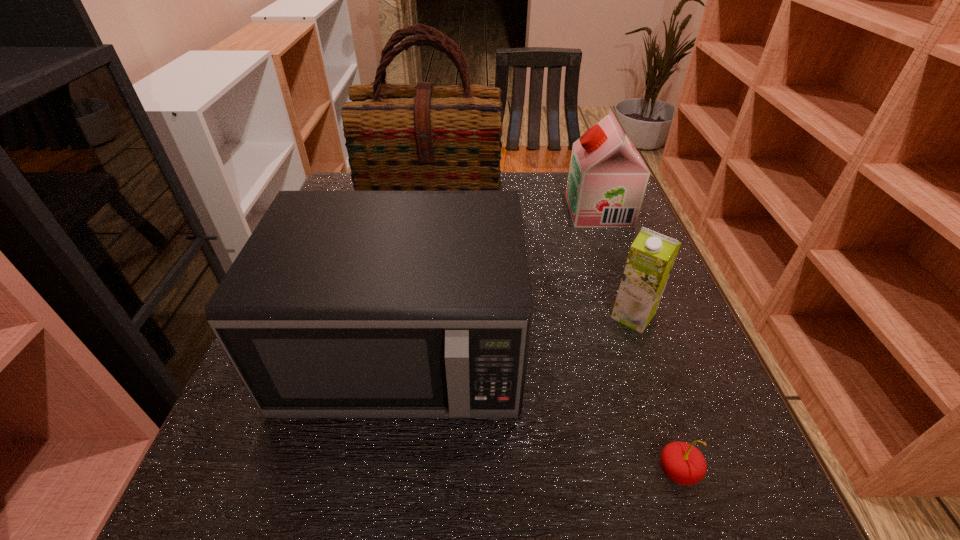
This screenshot has height=540, width=960. Find the location of `object located at the far left corner`. object located at the far left corner is located at coordinates (398, 137).

This screenshot has height=540, width=960. In order to click on object situated at the far right corner in this screenshot , I will do pos(607,179).

This screenshot has height=540, width=960. Find the location of `object positioned at the near right corner`. object positioned at the near right corner is located at coordinates click(x=681, y=462).

Identify the location of blank area at the far edge. [x=533, y=180].

You are a GUI agent. You are given a task and a screenshot of the screen. Output one action in this format:
    pyautogui.click(x=<x>, y=<y>)
    Task: Click on the free space at the near edge of the desktop
    This screenshot has height=540, width=960.
    Given the screenshot: What is the action you would take?
    pyautogui.click(x=335, y=498)

Identify the location of vacant space at the right edge of the desktop. This screenshot has width=960, height=540. (614, 300).

Image resolution: width=960 pixels, height=540 pixels. In the image, there is a desktop. Find the location of `free space at the far left corner`. free space at the far left corner is located at coordinates pos(337,187).

Locate an element on the screen. free area in between the fourth tallest object and the shopping bag is located at coordinates (534, 260).

Locate an element on the screen. This screenshot has width=960, height=540. blank region between the cherry and the tallest object is located at coordinates (556, 338).

At what (x,y) coordinates should I click in order to perform the action: click on free spot between the shopping bag and the fourth tallest object. Please return your answer as a coordinate pair (x, y). The width and height of the screenshot is (960, 540). Looking at the image, I should click on (534, 260).